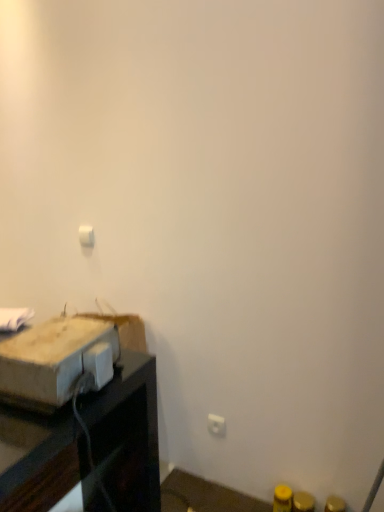
Question: From a real-world perspective, is white plastic electric outlet at lower right physically located above or below brown cardboard box at left?

Choices:
 (A) above
 (B) below

Answer: (B)

Question: Considering the positions of white plastic electric outlet at lower right and brown cardboard box at left in the image, is white plastic electric outlet at lower right wider or thinner than brown cardboard box at left?

Choices:
 (A) thin
 (B) wide

Answer: (A)

Question: Which is farther from the brown cardboard box at left?

Choices:
 (A) white plastic light switch at upper center
 (B) white plastic electric outlet at lower right

Answer: (B)

Question: Which object is positioned closest to the brown cardboard box at left?

Choices:
 (A) white plastic electric outlet at lower right
 (B) white plastic light switch at upper center

Answer: (B)